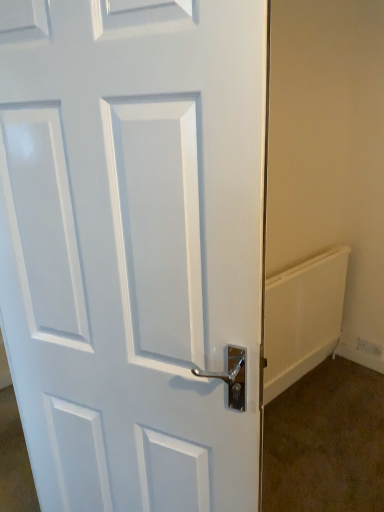
The height and width of the screenshot is (512, 384). What do you see at coordinates (135, 248) in the screenshot?
I see `white glossy door handle at center` at bounding box center [135, 248].

What is the approximate height of white glossy door handle at center?

It is 1.61 meters.

At what (x,y) coordinates should I click in order to perform the action: click on white glossy door handle at center. Please return your answer as a coordinate pair (x, y). Image resolution: width=384 pixels, height=512 pixels. Looking at the image, I should click on (135, 248).

The width and height of the screenshot is (384, 512). In order to click on white glossy door handle at center in this screenshot , I will do `click(135, 248)`.